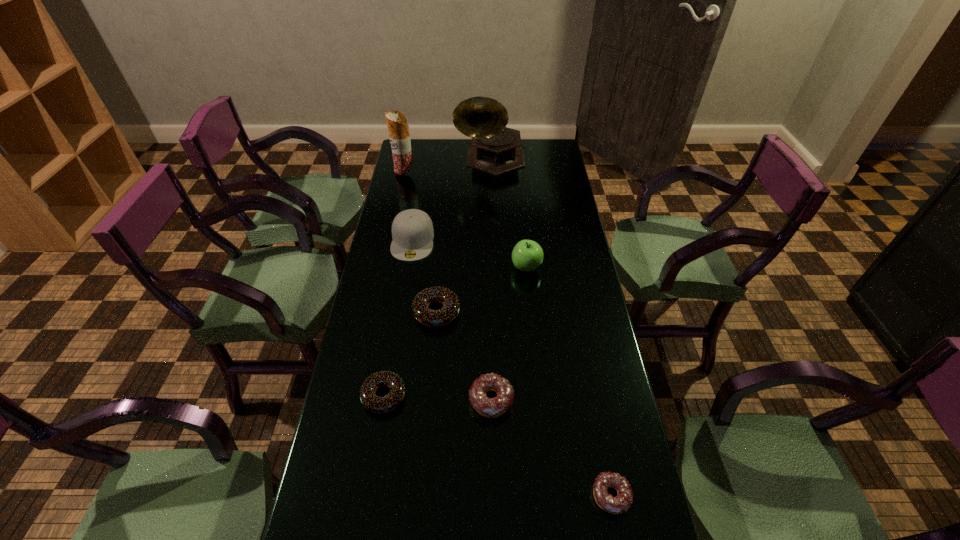
The height and width of the screenshot is (540, 960). In order to click on free space located on the back of the rightmost doughnut in this screenshot , I will do tap(591, 393).

Find the location of a particular element. object present at the far edge is located at coordinates (495, 149).

The width and height of the screenshot is (960, 540). In order to click on burrito that is at the left edge in this screenshot , I will do `click(399, 136)`.

What are the coordinates of `cap situated at the left edge` in the screenshot? It's located at (412, 230).

Where is `doughnut that is at the left edge`? The image size is (960, 540). doughnut that is at the left edge is located at coordinates (373, 403).

Where is `apple located in the right edge section of the desktop`? This screenshot has height=540, width=960. apple located in the right edge section of the desktop is located at coordinates (527, 255).

Image resolution: width=960 pixels, height=540 pixels. I want to click on doughnut located in the right edge section of the desktop, so click(x=621, y=503).

You are a GUI agent. You are given a task and a screenshot of the screen. Output one action in this format:
    pyautogui.click(x=<x>, y=<y>)
    Task: Click on the vacant space at the left edge of the desktop
    The height and width of the screenshot is (540, 960).
    Given the screenshot: What is the action you would take?
    pyautogui.click(x=330, y=534)

Locate an element on the screen. vacant space at the right edge is located at coordinates (599, 407).

Image resolution: width=960 pixels, height=540 pixels. What are the coordinates of `vacant space at the far left corner of the desktop` in the screenshot? It's located at (415, 139).